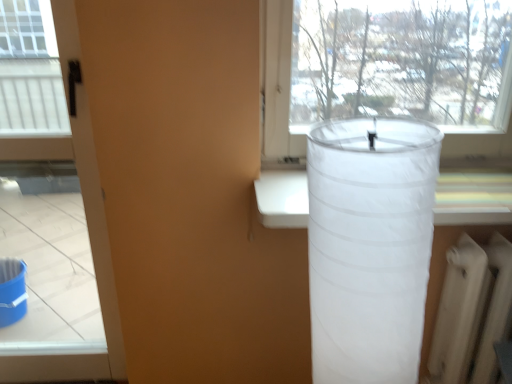
Question: Is white matte radiator at lower right oriented towards transparent fabric lampshade at right?

Choices:
 (A) yes
 (B) no

Answer: (B)

Question: From the image's perspective, is white matte radiator at lower right below transparent fabric lampshade at right?

Choices:
 (A) yes
 (B) no

Answer: (A)

Question: Is there a large distance between white matte radiator at lower right and transparent fabric lampshade at right?

Choices:
 (A) no
 (B) yes

Answer: (A)

Question: Is white matte radiator at lower right facing away from transparent fabric lampshade at right?

Choices:
 (A) no
 (B) yes

Answer: (A)

Question: Is the surface of white matte radiator at lower right in direct contact with transparent fabric lampshade at right?

Choices:
 (A) no
 (B) yes

Answer: (A)

Question: Is white matte radiator at lower right to the left or to the right of transparent fabric lampshade at right in the image?

Choices:
 (A) left
 (B) right

Answer: (B)

Question: In the image, is white matte radiator at lower right positioned in front of or behind transparent fabric lampshade at right?

Choices:
 (A) behind
 (B) front

Answer: (A)

Question: Considering the positions of white matte radiator at lower right and transparent fabric lampshade at right in the image, is white matte radiator at lower right taller or shorter than transparent fabric lampshade at right?

Choices:
 (A) tall
 (B) short

Answer: (B)

Question: From a real-world perspective, relative to transparent fabric lampshade at right, is white matte radiator at lower right vertically above or below?

Choices:
 (A) above
 (B) below

Answer: (B)

Question: Considering the relative positions of matte black screen door at left and white matte radiator at lower right in the image provided, is matte black screen door at left to the left or to the right of white matte radiator at lower right?

Choices:
 (A) right
 (B) left

Answer: (B)

Question: Considering the positions of matte black screen door at left and white matte radiator at lower right in the image, is matte black screen door at left taller or shorter than white matte radiator at lower right?

Choices:
 (A) short
 (B) tall

Answer: (B)

Question: In terms of width, does matte black screen door at left look wider or thinner when compared to white matte radiator at lower right?

Choices:
 (A) wide
 (B) thin

Answer: (B)

Question: Which is correct: matte black screen door at left is inside white matte radiator at lower right, or outside of it?

Choices:
 (A) inside
 (B) outside

Answer: (B)

Question: Is matte black screen door at left situated inside transparent fabric lampshade at right or outside?

Choices:
 (A) outside
 (B) inside

Answer: (A)

Question: Considering the positions of matte black screen door at left and transparent fabric lampshade at right in the image, is matte black screen door at left taller or shorter than transparent fabric lampshade at right?

Choices:
 (A) short
 (B) tall

Answer: (B)